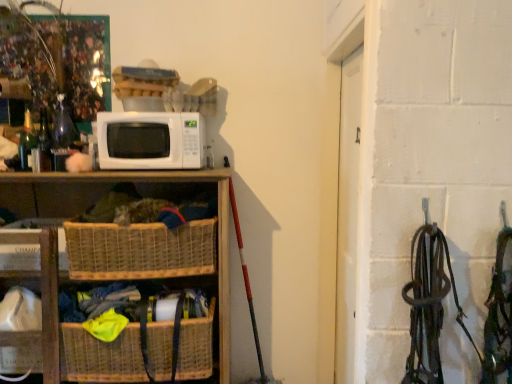
In the scene shown: Measure the distance between point (159, 346) and camera.

The distance of point (159, 346) from camera is 5.94 feet.

Locate an element on the screen. This screenshot has width=512, height=384. woven wood shelf at lower left, which is the first shelf from right to left is located at coordinates (163, 182).

Image resolution: width=512 pixels, height=384 pixels. What do you see at coordinates (41, 306) in the screenshot?
I see `woven wood basket at lower left, arranged as the 2th shelf when viewed from the right` at bounding box center [41, 306].

Locate an element on the screen. The height and width of the screenshot is (384, 512). white matte microwave at center is located at coordinates (150, 140).

From a real-world perspective, which is physically above, woven wood basket at lower left, arranged as the 2th shelf when viewed from the right, or white matte microwave at center?

In real-world perspective, white matte microwave at center is above.

Which is in front, point (3, 273) or point (123, 135)?

The point (123, 135) is in front.

Looking at their sizes, would you say woven wood basket at lower left, the first shelf from the left, is wider or thinner than white matte microwave at center?

In the image, woven wood basket at lower left, the first shelf from the left, appears to be wider than white matte microwave at center.

Could you measure the distance between woven wood basket at lower left, the first shelf from the left, and white matte microwave at center?

woven wood basket at lower left, the first shelf from the left, and white matte microwave at center are 60.92 centimeters apart from each other.

From the image's perspective, who appears lower, woven brown basket at lower center, marked as the 2th basket in a top-to-bottom arrangement, or woven wood basket at lower left, arranged as the 2th shelf when viewed from the right?

woven brown basket at lower center, marked as the 2th basket in a top-to-bottom arrangement, from the image's perspective.

Can you confirm if woven brown basket at lower center, the 1th basket from the bottom, is thinner than woven wood basket at lower left, the first shelf from the left?

Incorrect, the width of woven brown basket at lower center, the 1th basket from the bottom, is not less than that of woven wood basket at lower left, the first shelf from the left.

Is there a large distance between woven brown basket at lower center, the 1th basket from the bottom, and woven wood basket at lower left, arranged as the 2th shelf when viewed from the right?

That's not correct — woven brown basket at lower center, the 1th basket from the bottom, is a little close to woven wood basket at lower left, arranged as the 2th shelf when viewed from the right.

Which is behind, woven brown basket at lower left, which is the 2th basket from bottom to top, or woven brown basket at lower center, the 1th basket from the bottom?

woven brown basket at lower center, the 1th basket from the bottom.

Considering the positions of objects woven brown basket at lower left, which is the first basket in top-to-bottom order, and woven brown basket at lower center, marked as the 2th basket in a top-to-bottom arrangement, in the image provided, who is more to the left, woven brown basket at lower left, which is the first basket in top-to-bottom order, or woven brown basket at lower center, marked as the 2th basket in a top-to-bottom arrangement,?

woven brown basket at lower center, marked as the 2th basket in a top-to-bottom arrangement, is more to the left.

How distant is woven brown basket at lower left, which is the 2th basket from bottom to top, from woven brown basket at lower center, marked as the 2th basket in a top-to-bottom arrangement?

woven brown basket at lower left, which is the 2th basket from bottom to top, and woven brown basket at lower center, marked as the 2th basket in a top-to-bottom arrangement, are 12.52 inches apart.

Does point (212, 245) come in front of point (81, 328)?

No, (212, 245) is further to viewer.

From a real-world perspective, which object rests below the other?

woven wood basket at lower left, arranged as the 2th shelf when viewed from the right, from a real-world perspective.

Are green glass bottle at left and woven wood basket at lower left, arranged as the 2th shelf when viewed from the right, beside each other?

No, green glass bottle at left is not making contact with woven wood basket at lower left, arranged as the 2th shelf when viewed from the right.

In the scene shown: From the image's perspective, which one is positioned lower, green glass bottle at left or woven wood basket at lower left, the first shelf from the left?

woven wood basket at lower left, the first shelf from the left, appears lower in the image.

Is green glass bottle at left facing towards woven wood basket at lower left, arranged as the 2th shelf when viewed from the right?

No, green glass bottle at left is not oriented towards woven wood basket at lower left, arranged as the 2th shelf when viewed from the right.

In the scene shown: Which point is more forward, [24,153] or [219,283]?

Point [219,283]

Is green glass bottle at left taller or shorter than woven wood shelf at lower left, which is the first shelf from right to left?

green glass bottle at left is shorter than woven wood shelf at lower left, which is the first shelf from right to left.

From the image's perspective, is green glass bottle at left located above woven wood shelf at lower left, which ranks as the 2th shelf in left-to-right order?

Indeed, from the image's perspective, green glass bottle at left is shown above woven wood shelf at lower left, which ranks as the 2th shelf in left-to-right order.

From a real-world perspective, between green glass bottle at left and woven wood shelf at lower left, which is the first shelf from right to left, who is vertically higher?

In real-world perspective, green glass bottle at left is above.

From the picture: Which is more to the left, woven wood shelf at lower left, which is the first shelf from right to left, or woven brown basket at lower left, which is the 2th basket from bottom to top?

woven wood shelf at lower left, which is the first shelf from right to left, is more to the left.

Does point (219, 248) come behind point (118, 234)?

Yes, point (219, 248) is behind point (118, 234).

How different are the orientations of woven wood shelf at lower left, which is the first shelf from right to left, and woven brown basket at lower left, which is the 2th basket from bottom to top, in degrees?

The facing directions of woven wood shelf at lower left, which is the first shelf from right to left, and woven brown basket at lower left, which is the 2th basket from bottom to top, are 0.000974 degrees apart.

From a real-world perspective, is woven wood shelf at lower left, which is the first shelf from right to left, above or below white matte microwave at center?

In terms of real-world spatial position, woven wood shelf at lower left, which is the first shelf from right to left, is below white matte microwave at center.

From the image's perspective, between woven wood shelf at lower left, which is the first shelf from right to left, and white matte microwave at center, which one is located above?

white matte microwave at center, from the image's perspective.

Does woven wood shelf at lower left, which ranks as the 2th shelf in left-to-right order, have a lesser height compared to white matte microwave at center?

Incorrect, the height of woven wood shelf at lower left, which ranks as the 2th shelf in left-to-right order, does not fall short of that of white matte microwave at center.

Locate an element on the screen. This screenshot has height=384, width=512. microwave oven above the woven wood basket at lower left, the first shelf from the left (from a real-world perspective) is located at coordinates (150, 140).

This screenshot has height=384, width=512. In order to click on basket lying below the woven wood basket at lower left, arranged as the 2th shelf when viewed from the right (from the image's perspective) in this screenshot , I will do `click(102, 356)`.

Considering their positions, is woven brown basket at lower center, marked as the 2th basket in a top-to-bottom arrangement, positioned closer to woven wood basket at lower left, arranged as the 2th shelf when viewed from the right, than woven brown basket at lower left, which is the first basket in top-to-bottom order?

woven brown basket at lower center, marked as the 2th basket in a top-to-bottom arrangement, is positioned closer to the anchor woven wood basket at lower left, arranged as the 2th shelf when viewed from the right.

Estimate the real-world distances between objects in this image. Which object is closer to woven brown basket at lower left, which is the first basket in top-to-bottom order, woven brown basket at lower center, the 1th basket from the bottom, or green glass bottle at left?

woven brown basket at lower center, the 1th basket from the bottom, is closer to woven brown basket at lower left, which is the first basket in top-to-bottom order.

When comparing their distances from woven wood shelf at lower left, which is the first shelf from right to left, does woven wood basket at lower left, the first shelf from the left, or woven brown basket at lower left, which is the first basket in top-to-bottom order, seem closer?

woven brown basket at lower left, which is the first basket in top-to-bottom order.

Considering their positions, is green glass bottle at left positioned further to woven wood shelf at lower left, which ranks as the 2th shelf in left-to-right order, than woven wood basket at lower left, the first shelf from the left?

woven wood basket at lower left, the first shelf from the left, is further to woven wood shelf at lower left, which ranks as the 2th shelf in left-to-right order.

Looking at the image, which one is located closer to woven brown basket at lower left, which is the 2th basket from bottom to top, woven wood shelf at lower left, which is the first shelf from right to left, or woven wood basket at lower left, the first shelf from the left?

woven wood shelf at lower left, which is the first shelf from right to left, is positioned closer to the anchor woven brown basket at lower left, which is the 2th basket from bottom to top.

Estimate the real-world distances between objects in this image. Which object is further from white matte microwave at center, woven brown basket at lower left, which is the 2th basket from bottom to top, or woven wood basket at lower left, arranged as the 2th shelf when viewed from the right?

woven wood basket at lower left, arranged as the 2th shelf when viewed from the right, lies further to white matte microwave at center than the other object.

Estimate the real-world distances between objects in this image. Which object is closer to white matte microwave at center, woven brown basket at lower left, which is the 2th basket from bottom to top, or green glass bottle at left?

woven brown basket at lower left, which is the 2th basket from bottom to top, lies closer to white matte microwave at center than the other object.

Based on their spatial positions, is woven wood shelf at lower left, which ranks as the 2th shelf in left-to-right order, or woven brown basket at lower center, the 1th basket from the bottom, closer to white matte microwave at center?

Based on the image, woven wood shelf at lower left, which ranks as the 2th shelf in left-to-right order, appears to be nearer to white matte microwave at center.

Where is `bottle between white matte microwave at center and woven wood shelf at lower left, which is the first shelf from right to left, vertically`? The width and height of the screenshot is (512, 384). bottle between white matte microwave at center and woven wood shelf at lower left, which is the first shelf from right to left, vertically is located at coordinates (27, 141).

This screenshot has width=512, height=384. Find the location of `shelf between green glass bottle at left and woven wood basket at lower left, arranged as the 2th shelf when viewed from the right, vertically`. shelf between green glass bottle at left and woven wood basket at lower left, arranged as the 2th shelf when viewed from the right, vertically is located at coordinates (163, 182).

Find the location of a particular element. basket between woven wood basket at lower left, arranged as the 2th shelf when viewed from the right, and woven brown basket at lower left, which is the first basket in top-to-bottom order is located at coordinates (102, 356).

What are the coordinates of `basket between white matte microwave at center and woven brown basket at lower center, marked as the 2th basket in a top-to-bottom arrangement, in the vertical direction` in the screenshot? It's located at (140, 250).